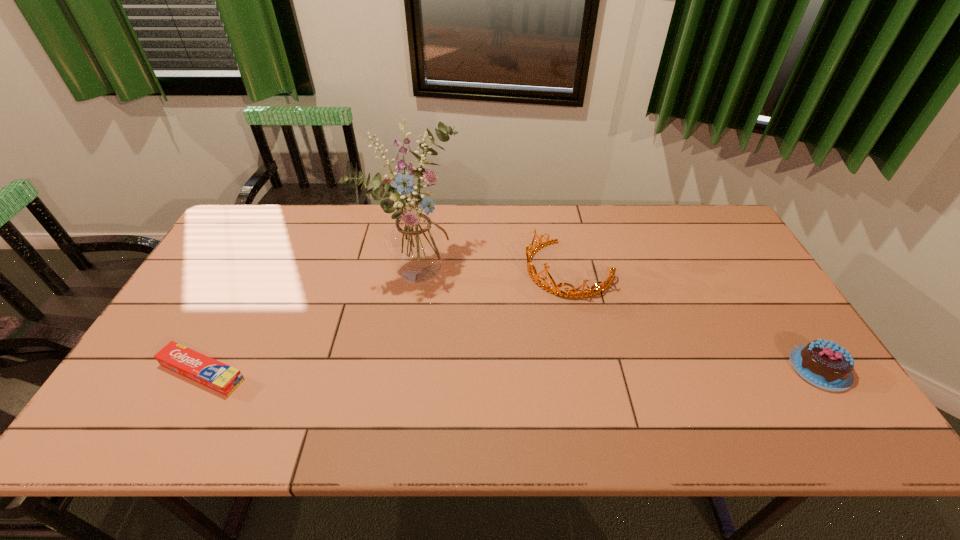
This screenshot has height=540, width=960. In order to click on the shortest object in this screenshot , I will do `click(198, 367)`.

Find the location of a particular element. The width and height of the screenshot is (960, 540). toothpaste is located at coordinates (198, 367).

In order to click on the rightmost object in this screenshot , I will do `click(824, 364)`.

Find the location of `the third tallest object`. the third tallest object is located at coordinates (824, 364).

This screenshot has height=540, width=960. I want to click on the second object from right to left, so click(x=531, y=268).

You are a GUI agent. You are given a task and a screenshot of the screen. Output one action in this format:
    pyautogui.click(x=<x>, y=<y>)
    Task: Click on the tiara
    The height and width of the screenshot is (540, 960).
    Given the screenshot: What is the action you would take?
    pyautogui.click(x=531, y=268)

The width and height of the screenshot is (960, 540). I want to click on the third object from right to left, so click(x=415, y=244).

Find the location of a particular element. The width and height of the screenshot is (960, 540). bouquet is located at coordinates (415, 244).

Locate an element on the screen. vacant space located on the right of the shortest object is located at coordinates (350, 373).

The image size is (960, 540). In order to click on vacant space situated 0.070m on the back of the chocolate cake in this screenshot , I will do `click(791, 325)`.